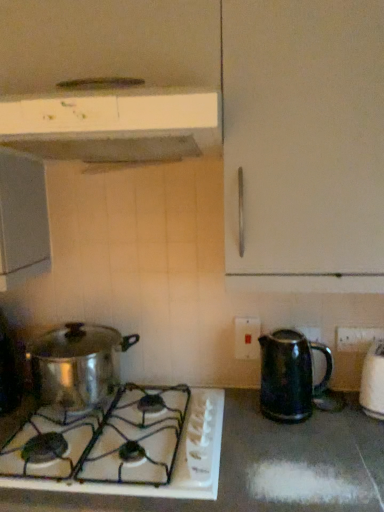
Question: Is black plastic electric outlet at lower right, which is counted as the 2th electric outlet, starting from the left, inside or outside of shiny metallic kettle at right, marked as the 3th kitchen appliance in a top-to-bottom arrangement?

Choices:
 (A) outside
 (B) inside

Answer: (A)

Question: Is black plastic electric outlet at lower right, which appears as the 2th electric outlet when viewed from the back, in front of or behind shiny metallic kettle at right, marked as the 3th kitchen appliance in a top-to-bottom arrangement, in the image?

Choices:
 (A) behind
 (B) front

Answer: (A)

Question: Which object is the closest to the white matte range hood at upper center, the 1th kitchen appliance in the top-to-bottom sequence?

Choices:
 (A) white plastic electric outlet at center, which is counted as the first electric outlet, starting from the back
 (B) white glossy gas stove at lower left
 (C) shiny metallic kettle at right, marked as the 3th kitchen appliance in a top-to-bottom arrangement
 (D) shiny metallic pot at lower left, which is the 2th kitchen appliance in bottom-to-top order
 (E) black plastic electric outlet at lower right, which is counted as the 2th electric outlet, starting from the left

Answer: (D)

Question: Based on their relative distances, which object is nearer to the white glossy gas stove at lower left?

Choices:
 (A) white matte range hood at upper center, the 1th kitchen appliance in the top-to-bottom sequence
 (B) shiny metallic pot at lower left, which is the 2th kitchen appliance in bottom-to-top order
 (C) white plastic electric outlet at center, the 2th electric outlet when ordered from right to left
 (D) shiny metallic kettle at right, the first kitchen appliance ordered from the bottom
 (E) black plastic electric outlet at lower right, which ranks as the 1th electric outlet in front-to-back order

Answer: (D)